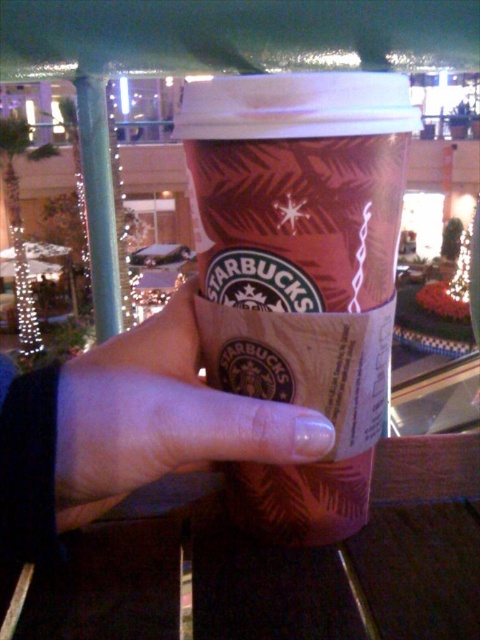
You are a barista at Starbucks. You see a matte paper cup at center and a nail polish at center. Which item is located higher in the image?

The matte paper cup at center is above the nail polish at center, so the matte paper cup at center is higher in the image.

You are designing a promotional card for Starbucks that needs to include both the matte paper cup at center and the nail polish at center. The card has a width of 4 inches. Can both items fit side by side without overlapping?

The matte paper cup at center and nail polish at center are 3.32 inches apart, so they can fit side by side on a 4 inch wide card since 3.32 inches is less than 4 inches.

You are a barista at Starbucks. You need to place a matte paper cup at center and a nail polish at center on a shelf. According to the image, which object should be placed closer to the front of the shelf?

The matte paper cup at center should be placed closer to the front of the shelf because it is in front of the nail polish at center in the image.